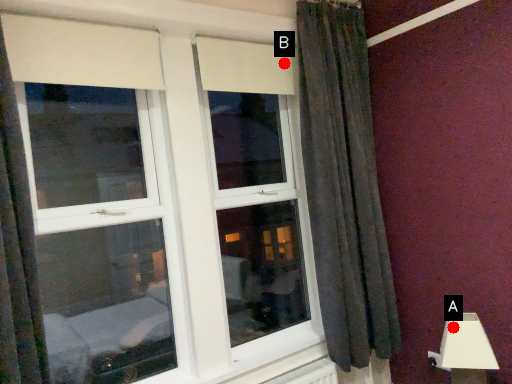
Question: Two points are circled on the image, labeled by A and B beside each circle. Which point is farther from the camera taking this photo?

Choices:
 (A) A is further
 (B) B is further

Answer: (B)